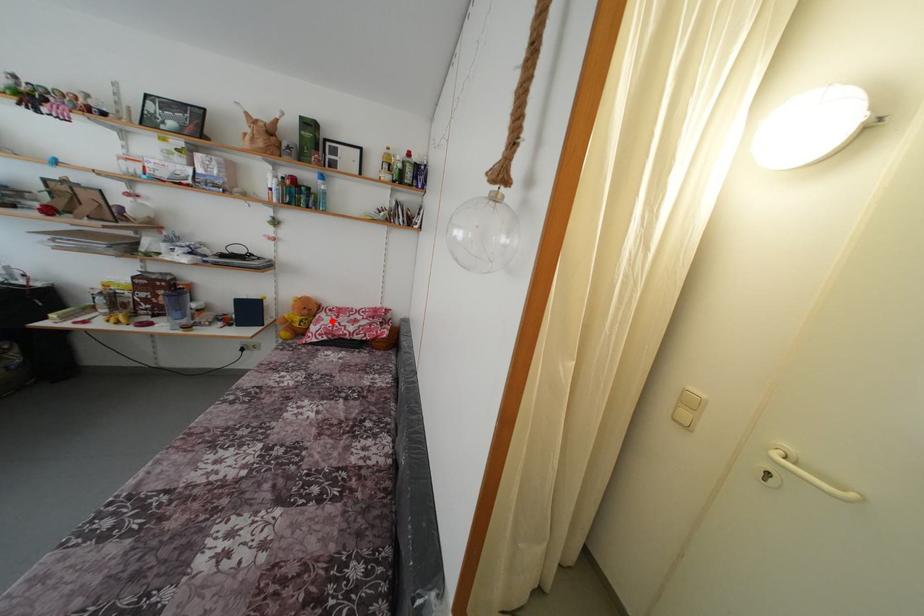
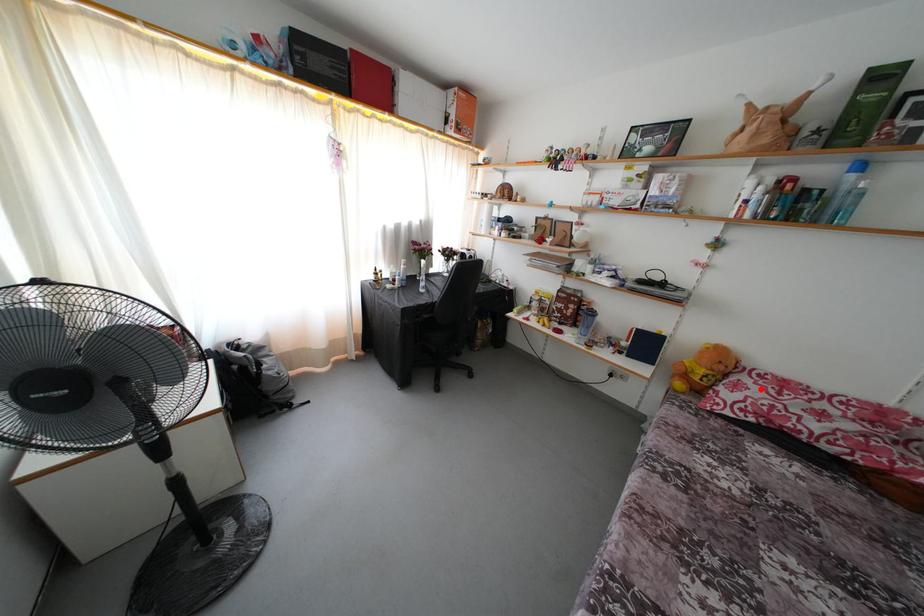
I am providing you with two images of the same scene from different viewpoints. A red point is marked on the first image and another point is marked on the second image. Is the red point in image1 aligned with the point shown in image2?

Yes